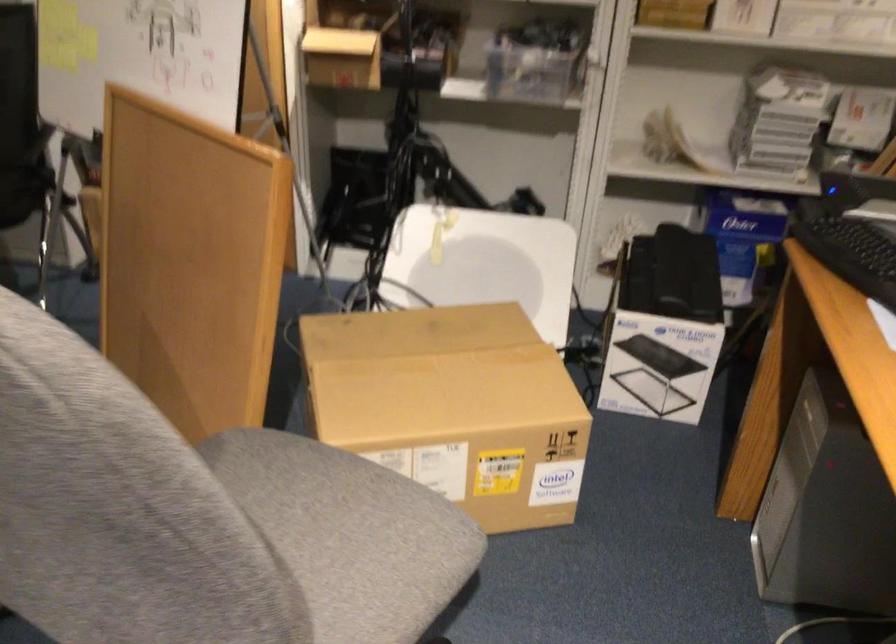
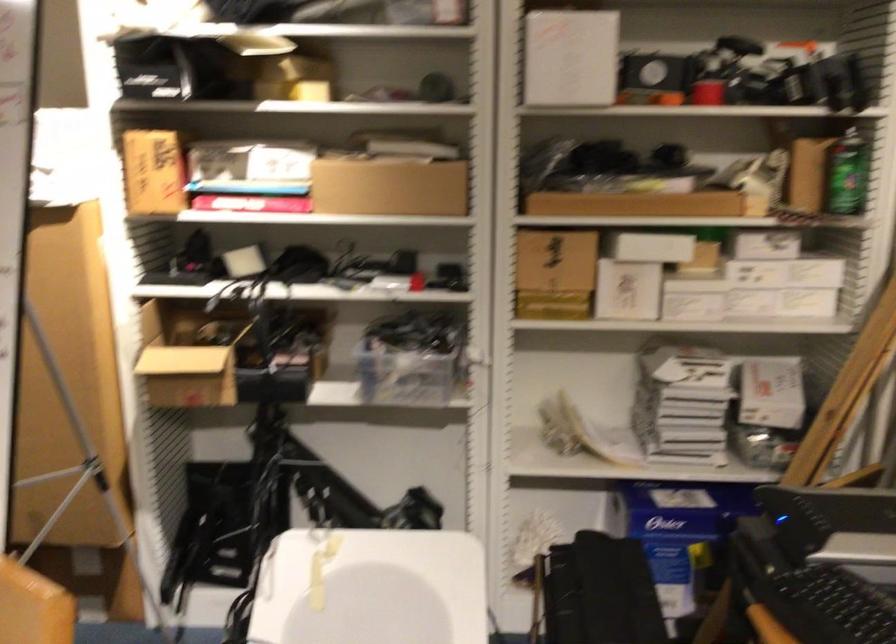
Where in the second image is the point corresponding to [759,236] from the first image?

(683, 534)